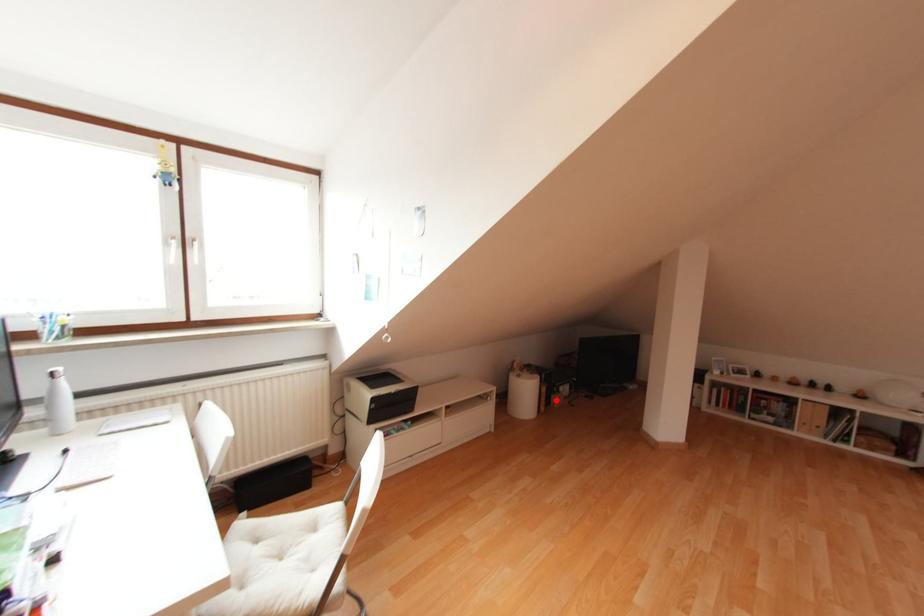
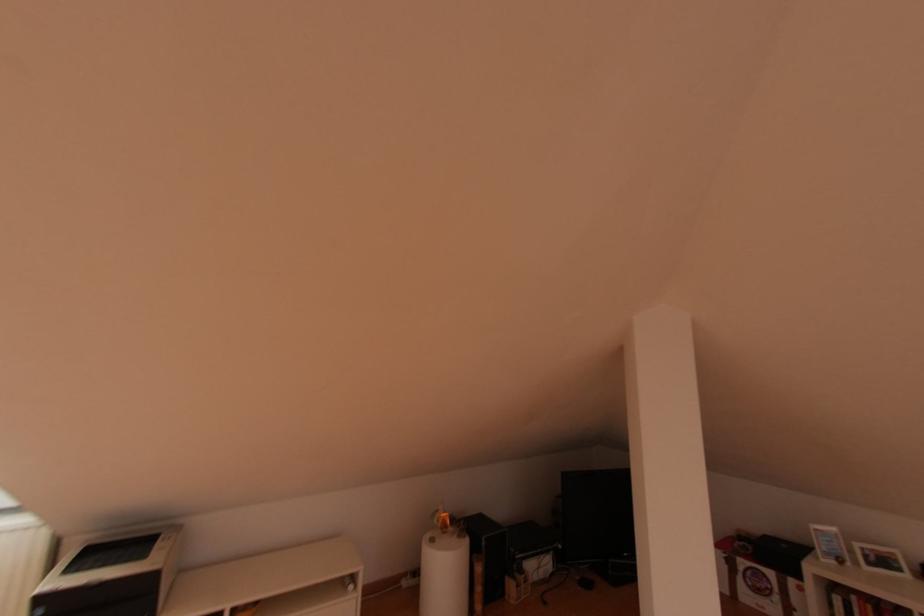
Question: I am providing you with two images of the same scene from different viewpoints. A red point is shown in image1. For the corresponding object point in image2, is it positioned nearer or farther from the camera?

Choices:
 (A) Nearer
 (B) Farther

Answer: (A)